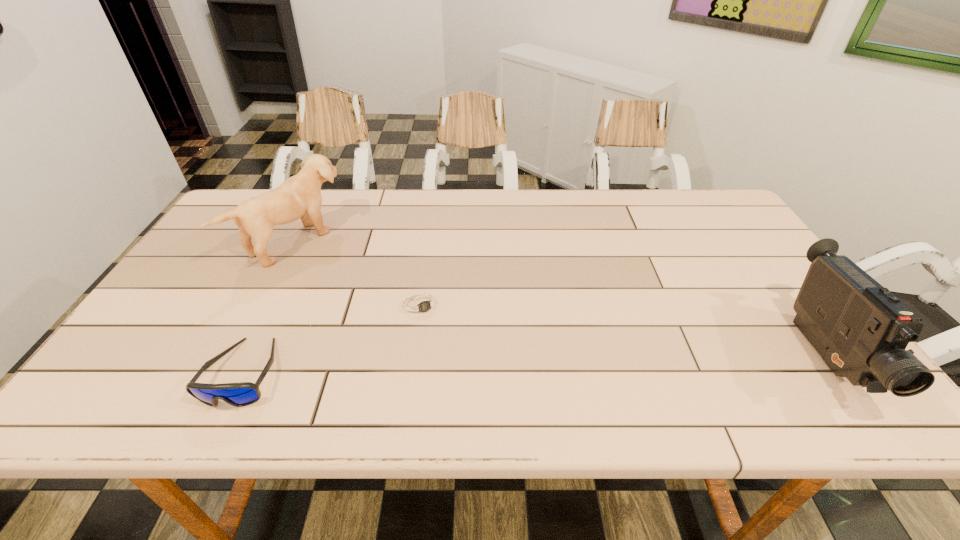
The height and width of the screenshot is (540, 960). Find the location of `the second shortest object`. the second shortest object is located at coordinates (240, 394).

This screenshot has height=540, width=960. What are the coordinates of `camcorder` in the screenshot? It's located at (861, 330).

Find the location of a particular element. This screenshot has width=960, height=540. the second object from right to left is located at coordinates (420, 305).

Where is `the shortest object`? The height and width of the screenshot is (540, 960). the shortest object is located at coordinates (420, 305).

Find the location of a particular element. Image resolution: width=960 pixels, height=540 pixels. puppy is located at coordinates coord(299,196).

You are a GUI agent. You are given a task and a screenshot of the screen. Output one action in this format:
    pyautogui.click(x=<x>, y=<y>)
    Task: Click on the free location located 0.090m on the face of the shortest object
    The image size is (960, 540).
    Given the screenshot: What is the action you would take?
    pyautogui.click(x=446, y=349)

Locate an element on the screen. This screenshot has height=540, width=960. free space located 0.110m on the face of the shortest object is located at coordinates (450, 355).

Where is `blank area located on the left side of the farthest object`? blank area located on the left side of the farthest object is located at coordinates (338, 271).

The image size is (960, 540). I want to click on vacant region located 0.120m on the left side of the farthest object, so click(x=354, y=281).

Locate an element on the screen. vacant space situated 0.070m on the left side of the farthest object is located at coordinates (343, 274).